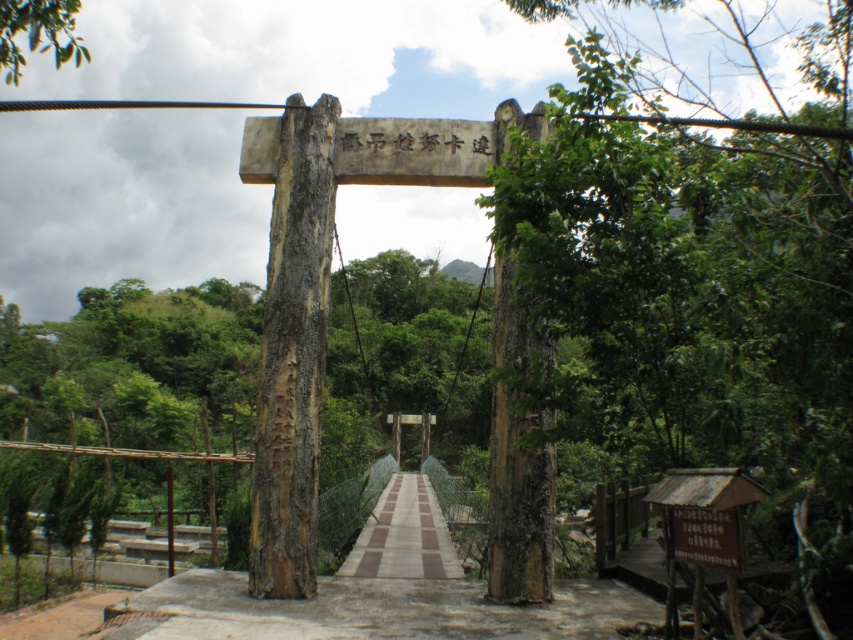
Can you confirm if brown concrete path at center is wider than brown textured path at center?

Correct, the width of brown concrete path at center exceeds that of brown textured path at center.

Locate an element on the screen. Image resolution: width=853 pixels, height=640 pixels. brown concrete path at center is located at coordinates (383, 595).

Which is behind, point (184, 586) or point (67, 17)?

The point (67, 17) is behind.

At what (x,y) coordinates should I click in order to perform the action: click on brown concrete path at center. Please return your answer as a coordinate pair (x, y). Looking at the image, I should click on (383, 595).

Is point (244, 580) positioned after point (3, 67)?

That is False.

This screenshot has width=853, height=640. What are the coordinates of `brown concrete path at center` in the screenshot? It's located at (383, 595).

Who is higher up, brown rough wood at upper center or brown textured path at center?

brown rough wood at upper center is above.

Which is below, brown rough wood at upper center or brown textured path at center?

brown textured path at center

Which is behind, point (799, 404) or point (402, 490)?

Positioned behind is point (402, 490).

Identify the location of brown rough wood at upper center. (705, 276).